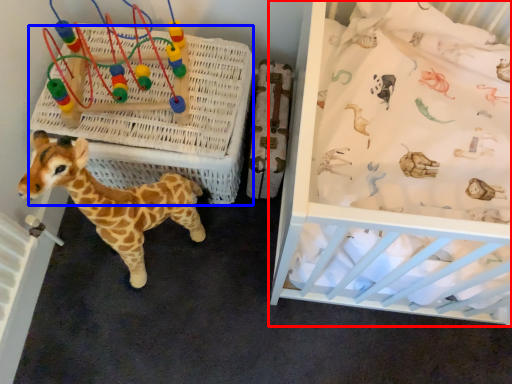
Question: Among these objects, which one is farthest to the camera, infant bed (highlighted by a red box) or crate (highlighted by a blue box)?

Choices:
 (A) infant bed
 (B) crate

Answer: (B)